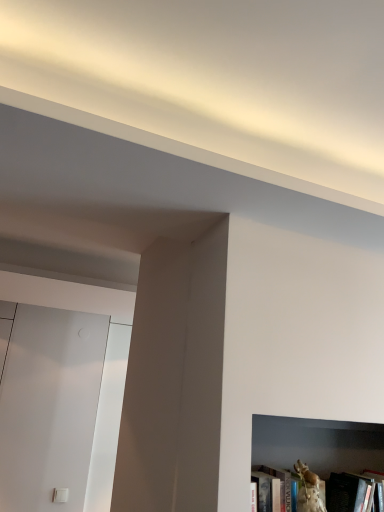
What do you see at coordinates (317, 444) in the screenshot? This screenshot has width=384, height=512. I see `wooden bookshelf at lower right` at bounding box center [317, 444].

Identify the location of wooden bookshelf at lower right. This screenshot has height=512, width=384. (317, 444).

Identify the location of wooden bookshelf at lower right. The width and height of the screenshot is (384, 512). (317, 444).